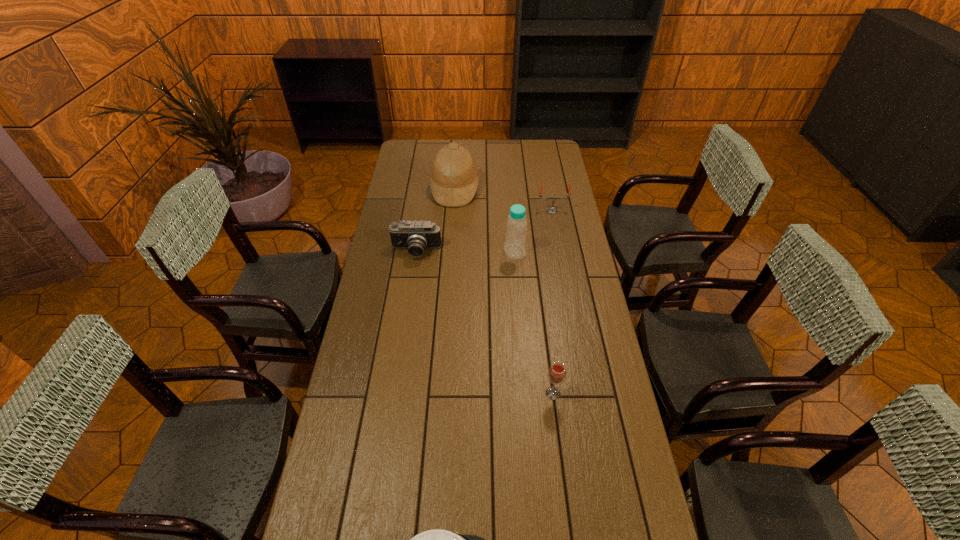
You are a GUI agent. You are given a task and a screenshot of the screen. Output one action in this format:
    pyautogui.click(x=<x>, y=<y>)
    Task: Click on the free point that satisfies the following two spatial constraints: 1. on the front-facing side of the taller hat; 2. on the left side of the fifth object from left to right
    The height and width of the screenshot is (540, 960).
    Given the screenshot: What is the action you would take?
    pyautogui.click(x=441, y=393)

You are a GUI agent. You are given a task and a screenshot of the screen. Output one action in this format:
    pyautogui.click(x=<x>, y=<y>)
    Task: Click on the free point that satisfies the following two spatial constraints: 1. on the front-facing side of the second nearest object; 2. on the right side of the camera
    
    Given the screenshot: What is the action you would take?
    pyautogui.click(x=396, y=393)

Locate an element on the screen. The width and height of the screenshot is (960, 540). blank space that satisfies the following two spatial constraints: 1. on the front-facing side of the wineglass; 2. on the left side of the camera is located at coordinates (396, 393).